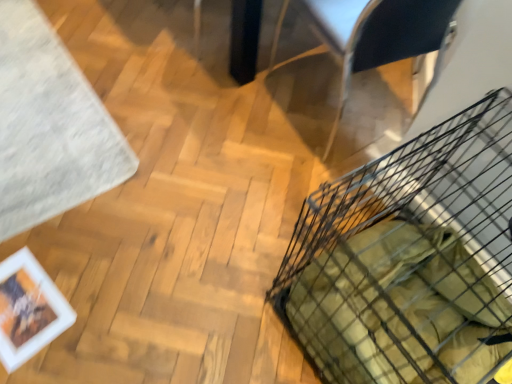
This screenshot has width=512, height=384. I want to click on vacant space positioned to the left of black wire basket at lower right, so click(203, 287).